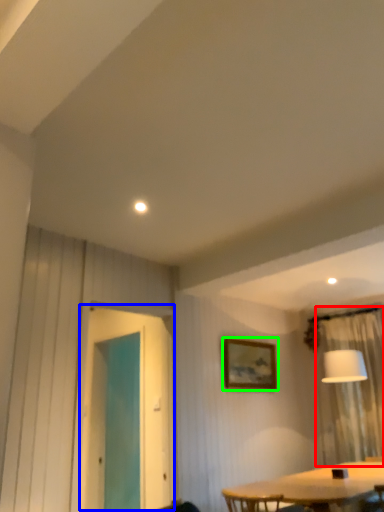
Question: Based on their relative distances, which object is nearer to curtain (highlighted by a red box)? Choose from screen door (highlighted by a blue box) and picture frame (highlighted by a green box).

Choices:
 (A) screen door
 (B) picture frame

Answer: (B)